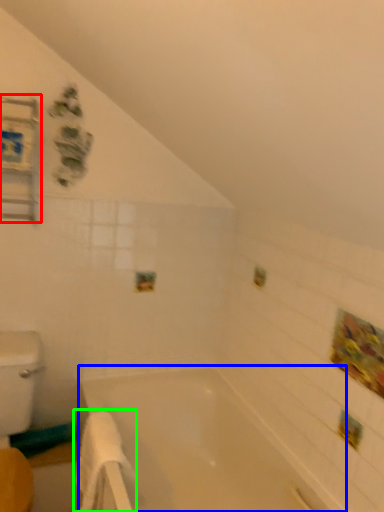
Question: Which is nearer to the medicine cabinet (highlighted by a red box)? bathtub (highlighted by a blue box) or bath towel (highlighted by a green box).

Choices:
 (A) bathtub
 (B) bath towel

Answer: (B)